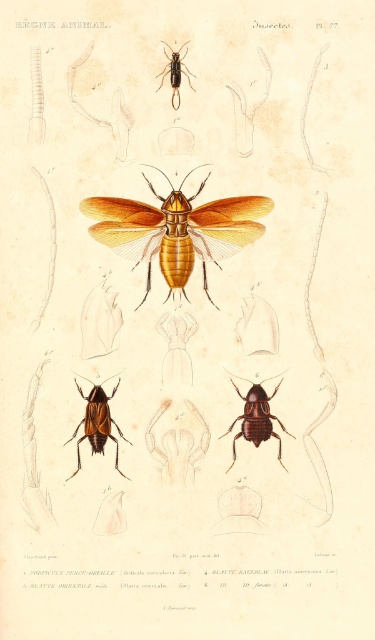
Question: Based on their relative distances, which object is nearer to the shiny brown beetle at lower center?

Choices:
 (A) matte yellow winged insect at center
 (B) shiny brown beetle at center

Answer: (B)

Question: Can you confirm if shiny brown beetle at center is positioned above shiny black beetle at upper center?

Choices:
 (A) yes
 (B) no

Answer: (B)

Question: From the image, what is the correct spatial relationship of matte yellow winged insect at center in relation to shiny brown beetle at lower center?

Choices:
 (A) below
 (B) above

Answer: (B)

Question: Which point appears closest to the camera in this image?

Choices:
 (A) (199, 211)
 (B) (109, 410)
 (C) (187, 72)

Answer: (C)

Question: Can you confirm if shiny brown beetle at lower center is bigger than shiny brown beetle at center?

Choices:
 (A) no
 (B) yes

Answer: (B)

Question: Which point is closer to the camera?

Choices:
 (A) (142, 241)
 (B) (264, 436)
 (C) (195, 90)
 (D) (100, 424)

Answer: (C)